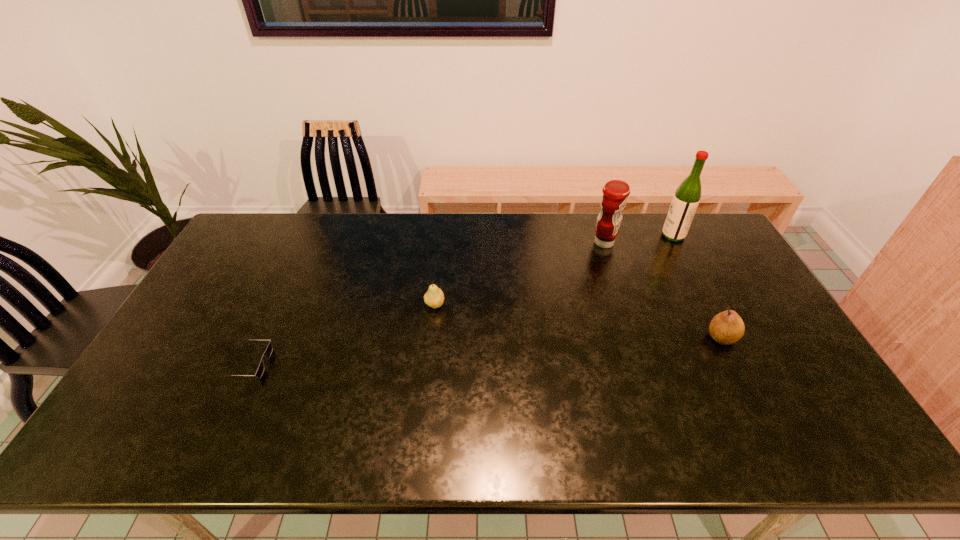
Identify the location of blank space located on the label of the tallest object. The width and height of the screenshot is (960, 540). pyautogui.click(x=607, y=235).

The height and width of the screenshot is (540, 960). Find the location of `vacant space positioned on the label of the tallest object`. vacant space positioned on the label of the tallest object is located at coordinates (623, 235).

The height and width of the screenshot is (540, 960). Find the location of `free space located 0.370m on the front of the fourth shortest object`. free space located 0.370m on the front of the fourth shortest object is located at coordinates (635, 336).

Locate an element on the screen. This screenshot has width=960, height=540. vacant space located 0.070m on the left of the nearer pear is located at coordinates (682, 338).

I want to click on free region located 0.210m on the back of the left pear, so click(440, 254).

Locate an element on the screen. vacant space situated on the front-facing side of the sunglasses is located at coordinates (360, 364).

You are a GUI agent. You are given a task and a screenshot of the screen. Output one action in this format:
    pyautogui.click(x=<x>, y=<y>)
    Task: Click on the liquor situated at the far edge
    The width and height of the screenshot is (960, 540).
    Given the screenshot: What is the action you would take?
    [685, 201]

Find the location of a particular element. condiment at the far edge is located at coordinates (615, 192).

The height and width of the screenshot is (540, 960). In order to click on liquor that is at the right edge in this screenshot , I will do `click(685, 201)`.

Identify the location of pear that is positioned at the right edge. (727, 327).